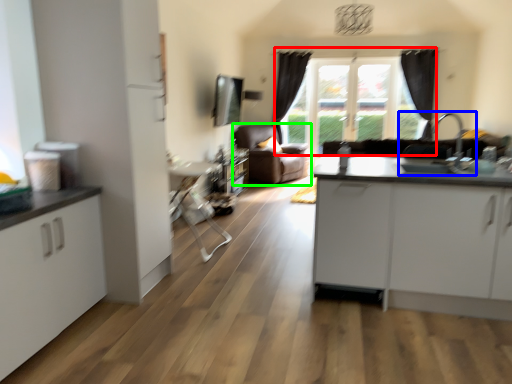
Question: Based on their relative distances, which object is farther from window (highlighted by a red box)? Choose from sink (highlighted by a blue box) and studio couch (highlighted by a green box).

Choices:
 (A) sink
 (B) studio couch

Answer: (A)